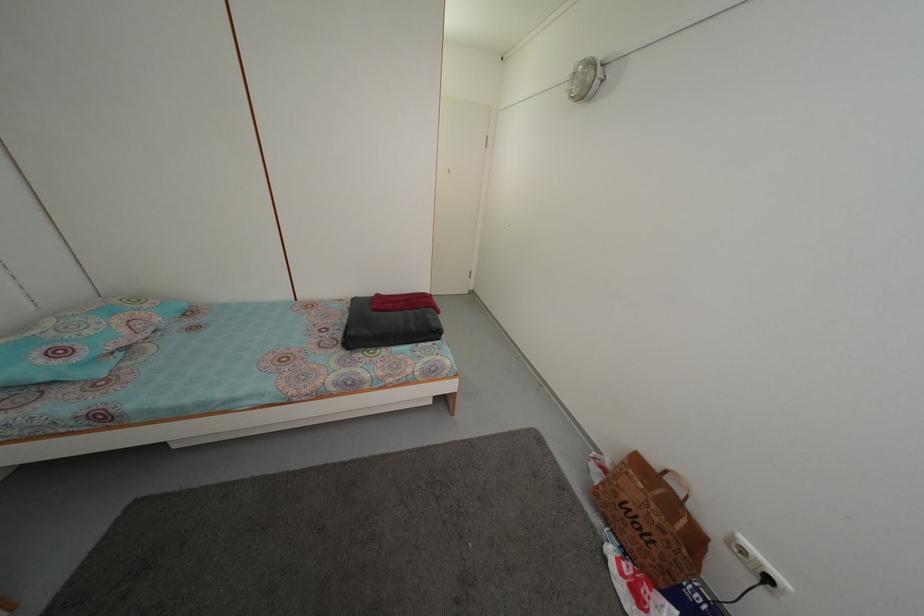
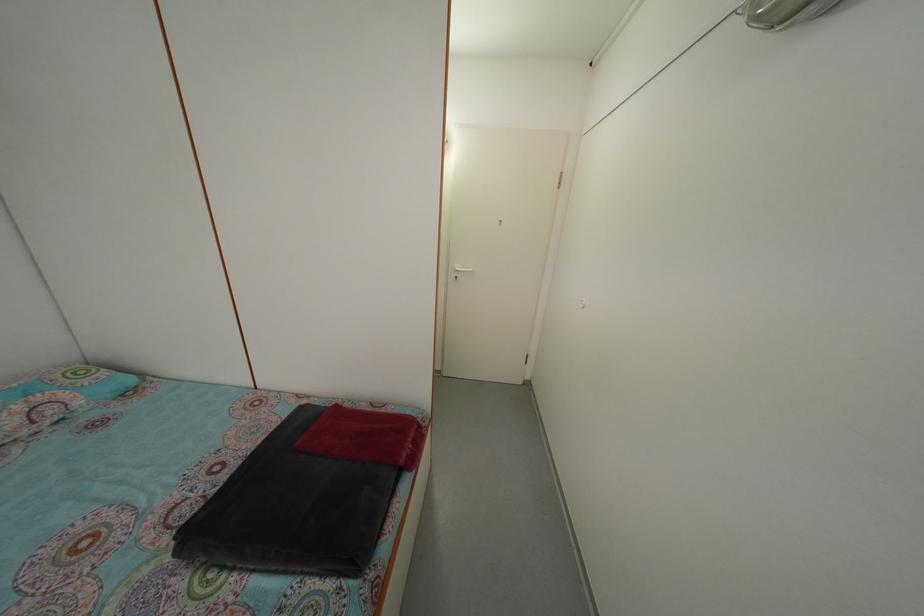
In a continuous first-person perspective shot, in which direction is the camera moving?

The movement direction of the cameraman is right, forward.